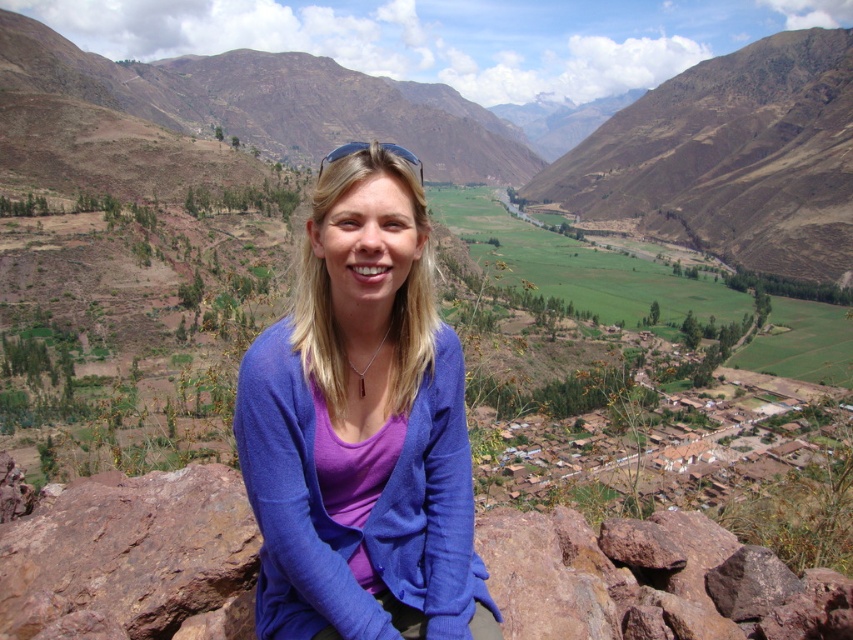
Question: Where is purple soft sweater at center located in relation to rusty rock at center in the image?

Choices:
 (A) below
 (B) above

Answer: (B)

Question: Is purple soft sweater at center smaller than rusty rock at center?

Choices:
 (A) yes
 (B) no

Answer: (A)

Question: Which point appears farthest from the camera in this image?

Choices:
 (A) pos(434,410)
 (B) pos(143,614)

Answer: (B)

Question: Does purple soft sweater at center have a lesser width compared to rusty rock at center?

Choices:
 (A) yes
 (B) no

Answer: (A)